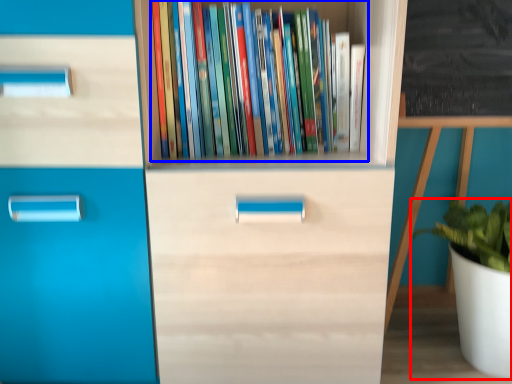
Question: Which object is closer to the camera taking this photo, houseplant (highlighted by a red box) or book (highlighted by a blue box)?

Choices:
 (A) houseplant
 (B) book

Answer: (B)